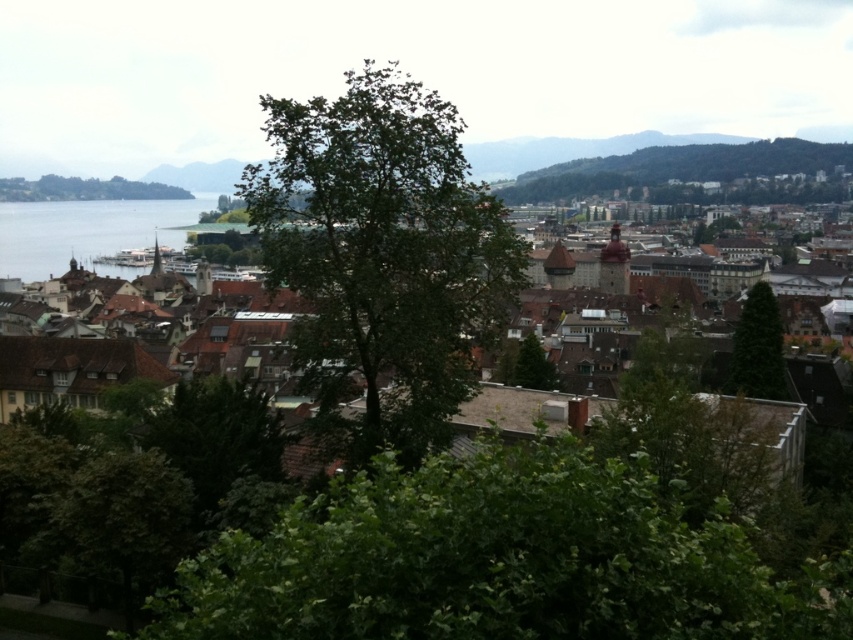
Question: From the image, what is the correct spatial relationship of green leafy tree at upper right in relation to brown tiled roofs at center?

Choices:
 (A) left
 (B) right

Answer: (B)

Question: Which point appears farthest from the camera in this image?

Choices:
 (A) pyautogui.click(x=20, y=241)
 (B) pyautogui.click(x=148, y=189)
 (C) pyautogui.click(x=521, y=381)
 (D) pyautogui.click(x=91, y=204)

Answer: (D)

Question: Is the position of green leafy tree at center more distant than that of green matte tree at center?

Choices:
 (A) yes
 (B) no

Answer: (B)

Question: Which point appears farthest from the camera in this image?

Choices:
 (A) (51, 269)
 (B) (39, 196)
 (C) (827, 150)

Answer: (B)

Question: Among these objects, which one is nearest to the camera?

Choices:
 (A) green leafy tree at upper right
 (B) green leafy tree at center
 (C) brown tiled roofs at center

Answer: (B)

Question: Is green leafy tree at center wider than green leafy tree at left?

Choices:
 (A) yes
 (B) no

Answer: (B)